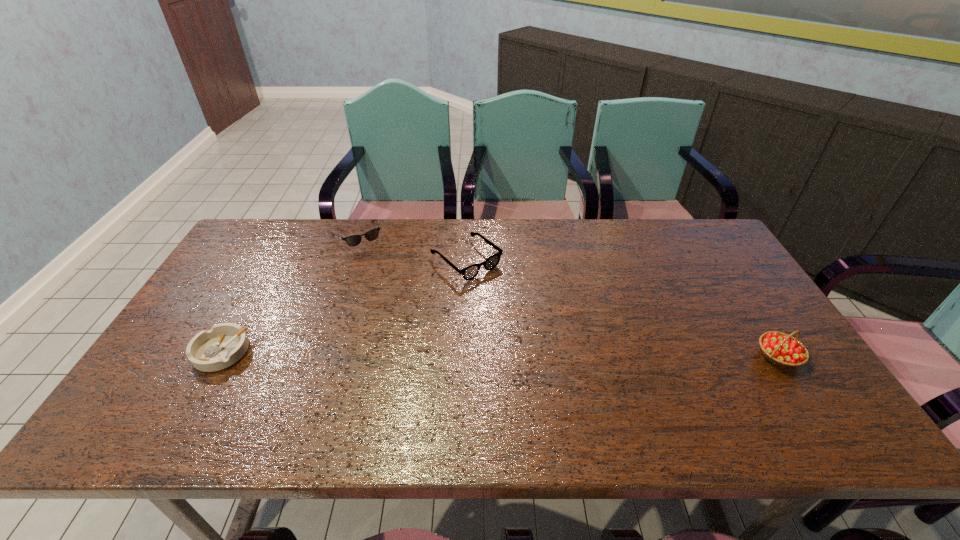
The image size is (960, 540). In order to click on free location that satisfies the following two spatial constraints: 1. on the back side of the sunglasses; 2. on the right side of the ashtray in this screenshot , I will do `click(286, 236)`.

The image size is (960, 540). Find the location of `vacant space that satisfies the following two spatial constraints: 1. on the front side of the spectacles; 2. on the left side of the tallest object`. vacant space that satisfies the following two spatial constraints: 1. on the front side of the spectacles; 2. on the left side of the tallest object is located at coordinates (463, 356).

The image size is (960, 540). In order to click on vacant position in the image that satisfies the following two spatial constraints: 1. on the back side of the sunglasses; 2. on the right side of the leftmost object in this screenshot , I will do `click(286, 236)`.

Where is `free space that satisfies the following two spatial constraints: 1. on the front side of the sunglasses; 2. on the right side of the third object from left to right`? This screenshot has width=960, height=540. free space that satisfies the following two spatial constraints: 1. on the front side of the sunglasses; 2. on the right side of the third object from left to right is located at coordinates (348, 261).

At what (x,y) coordinates should I click in order to perform the action: click on free spot that satisfies the following two spatial constraints: 1. on the back side of the third object from left to right; 2. on the right side of the ashtray. Please return your answer as a coordinate pair (x, y). Looking at the image, I should click on pos(273,261).